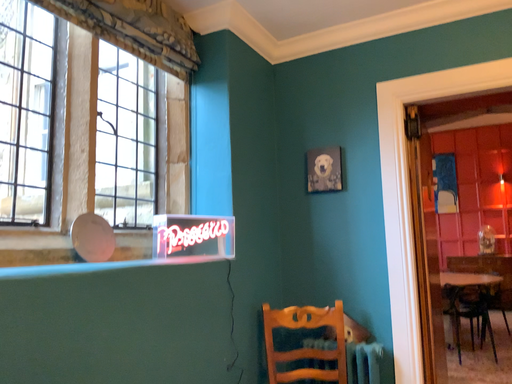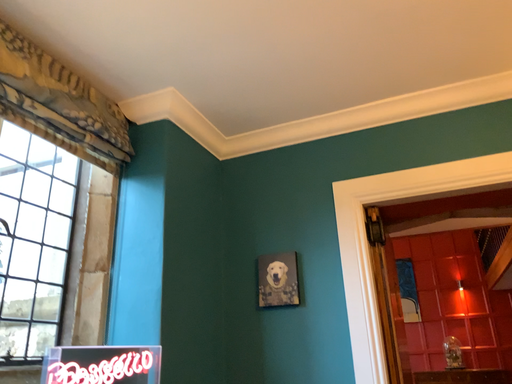
Question: Which way did the camera rotate in the video?

Choices:
 (A) rotated downward
 (B) rotated upward

Answer: (B)